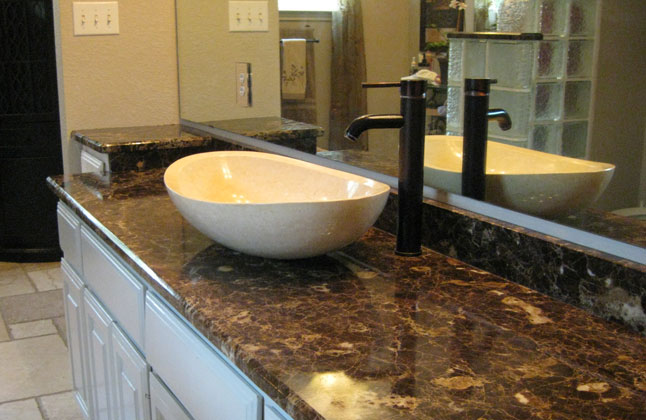
In order to click on drawer fronts in this screenshot , I will do `click(234, 386)`, `click(108, 287)`, `click(70, 243)`, `click(86, 160)`.